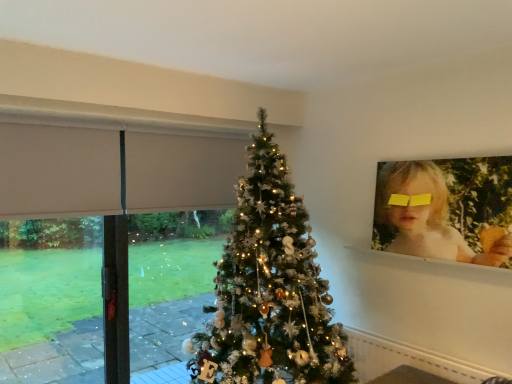
Question: Is point (283, 135) closer or farther from the camera than point (240, 276)?

Choices:
 (A) closer
 (B) farther

Answer: (B)

Question: Is beige fabric at left in front of or behind white glittery christmas tree at center in the image?

Choices:
 (A) behind
 (B) front

Answer: (A)

Question: Estimate the real-world distances between objects in this image. Which object is closer to the blonde hair at upper right?

Choices:
 (A) white glossy window sill at upper right
 (B) beige fabric at left
 (C) white glittery christmas tree at center

Answer: (A)

Question: Which object is positioned closest to the beige fabric at left?

Choices:
 (A) blonde hair at upper right
 (B) white glittery christmas tree at center
 (C) white glossy window sill at upper right

Answer: (B)